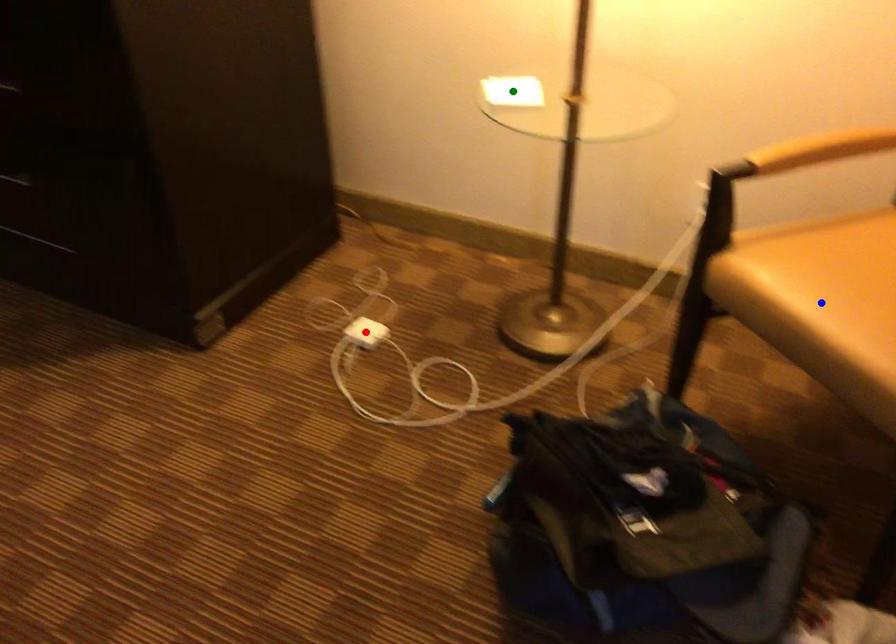
Order these from nearest to farthest:
1. blue point
2. red point
3. green point

blue point, green point, red point